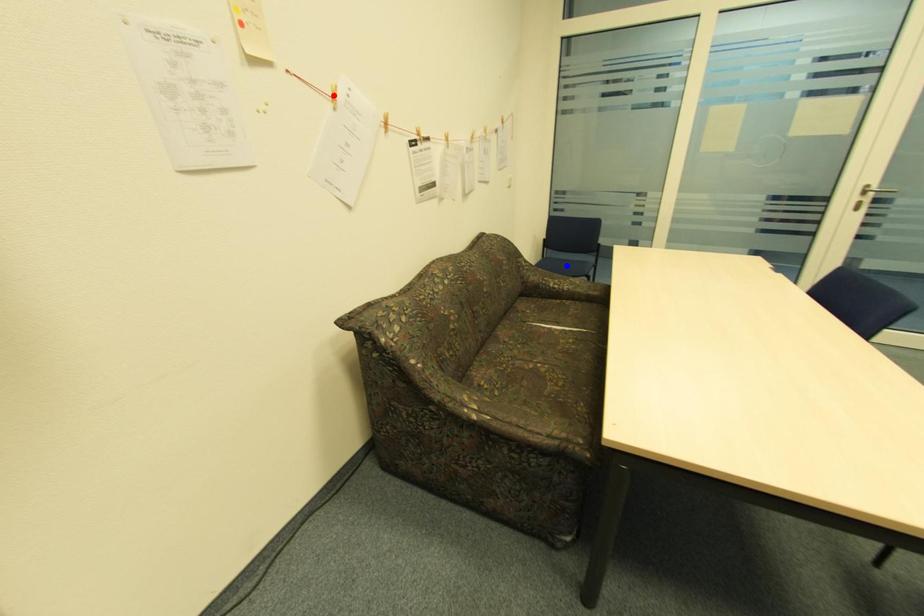
Question: Two points are marked on the image. Which point is closer to the camera?

Choices:
 (A) Blue point is closer.
 (B) Red point is closer.

Answer: (B)